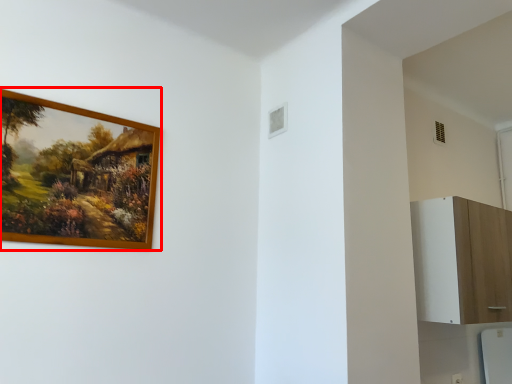
Question: From the image's perspective, where is picture frame (annotated by the red box) located relative to dresser?

Choices:
 (A) above
 (B) below

Answer: (A)